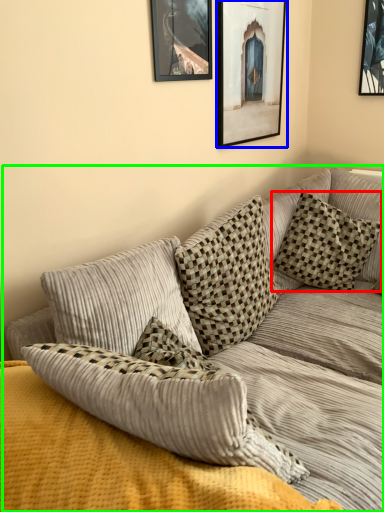
Question: Which object is positioned farthest from pillow (highlighted by a red box)? Select from picture frame (highlighted by a blue box) and studio couch (highlighted by a green box).

Choices:
 (A) picture frame
 (B) studio couch

Answer: (A)